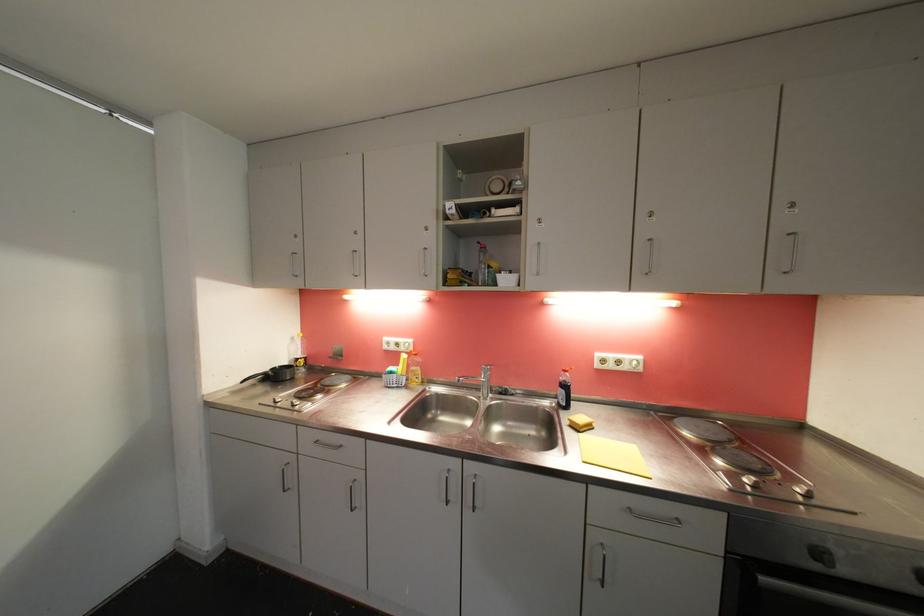
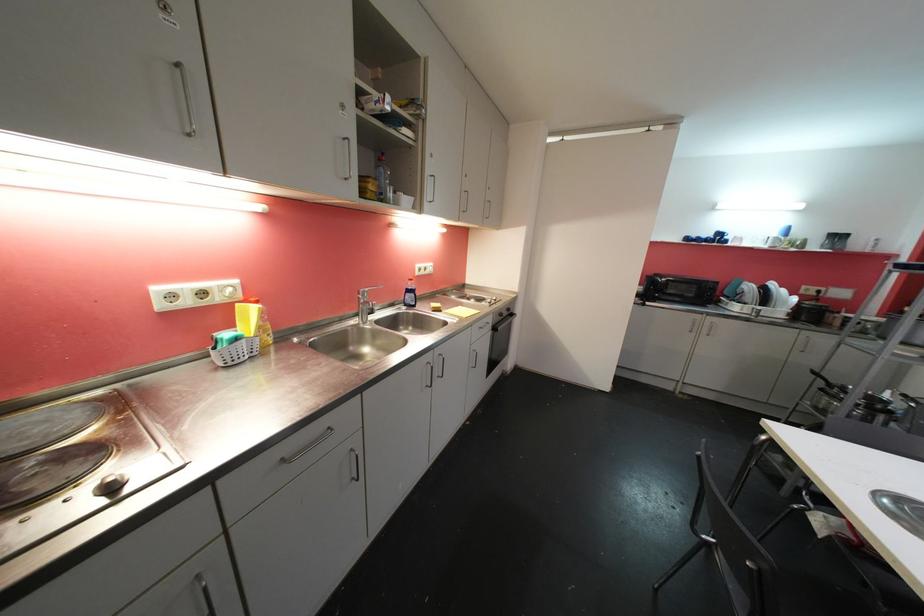
The point at (824, 557) is marked in the first image. Where is the corresponding point in the second image?

(505, 317)